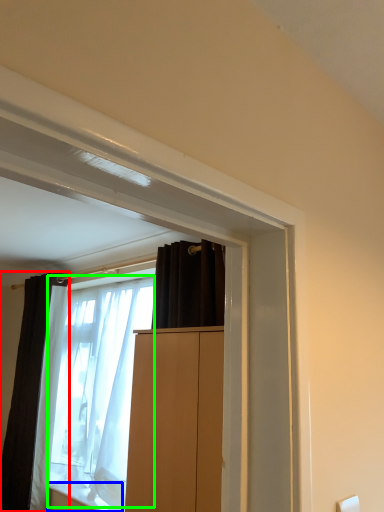
Question: Which is farther away from curtain (highlighted by a red box)? window sill (highlighted by a blue box) or shower curtain (highlighted by a green box)?

Choices:
 (A) window sill
 (B) shower curtain

Answer: (A)